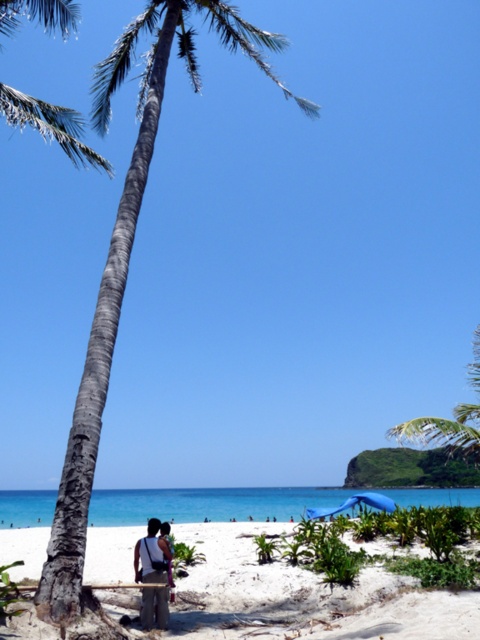
Does point (285, 596) come farther from viewer compared to point (108, 104)?

No, (285, 596) is in front of (108, 104).

Looking at this image, who is more distant from viewer, (389, 624) or (69, 586)?

The point (69, 586) is behind.

Is point (257, 573) closer to viewer compared to point (110, 52)?

Yes, point (257, 573) is in front of point (110, 52).

Locate an element on the screen. white sandy beach at lower center is located at coordinates (304, 596).

How distant is white sandy beach at lower center from dark gray fabric bag at lower center?

white sandy beach at lower center is 14.52 feet away from dark gray fabric bag at lower center.

Between point (203, 589) and point (160, 570), which one is positioned in front?

Point (160, 570)

This screenshot has height=640, width=480. What are the coordinates of `white sandy beach at lower center` in the screenshot? It's located at (304, 596).

Which is in front, point (241, 32) or point (167, 598)?

Point (167, 598)

Is point (137, 26) farther from camera compared to point (159, 618)?

Yes, point (137, 26) is farther from viewer.

Where is `gray bark palm tree at left`? The image size is (480, 640). gray bark palm tree at left is located at coordinates (127, 262).